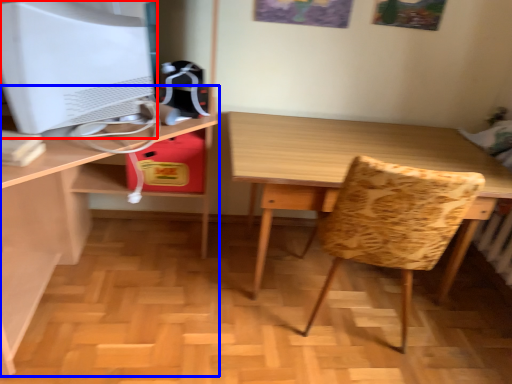
Question: Which object appears closest to the camera in this image, computer monitor (highlighted by a red box) or desk (highlighted by a blue box)?

Choices:
 (A) computer monitor
 (B) desk

Answer: (B)